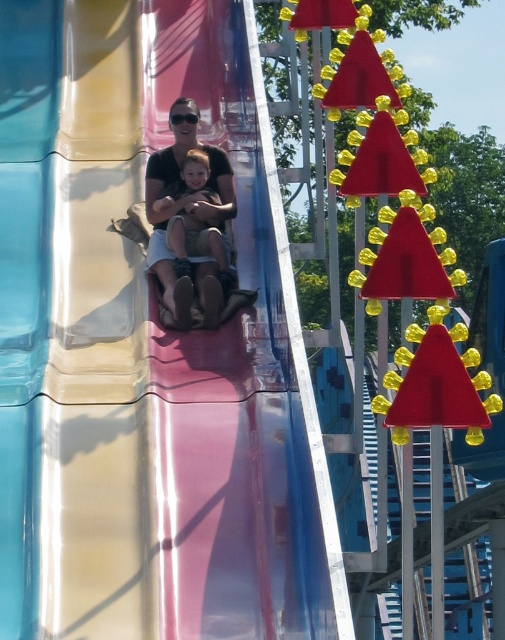
Is matte brown shorts at center behind black plastic goggles at center?

No, matte brown shorts at center is closer to the viewer.

Who is more forward, (x=213, y=157) or (x=176, y=115)?

Point (x=176, y=115) is more forward.

Which is in front, point (218, 193) or point (181, 120)?

Point (218, 193) is more forward.

The image size is (505, 640). Find the location of `matte brown shorts at center`. matte brown shorts at center is located at coordinates click(189, 176).

Can you confirm if matte black shirt at center is positioned below black plastic goggles at center?

Yes, matte black shirt at center is below black plastic goggles at center.

Between point (224, 186) and point (193, 120), which one is positioned in front?

Point (224, 186)

Is point (224, 193) positioned after point (185, 116)?

No, it is in front of (185, 116).

Locate an element on the screen. matte black shirt at center is located at coordinates (191, 218).

Between translucent plastic slide at center and matte black shirt at center, which one is positioned lower?

Positioned lower is translucent plastic slide at center.

Describe the element at coordinates (148, 348) in the screenshot. I see `translucent plastic slide at center` at that location.

Which is behind, point (222, 404) or point (191, 145)?

Positioned behind is point (191, 145).

Locate an element on the screen. This screenshot has height=640, width=505. translucent plastic slide at center is located at coordinates (148, 348).